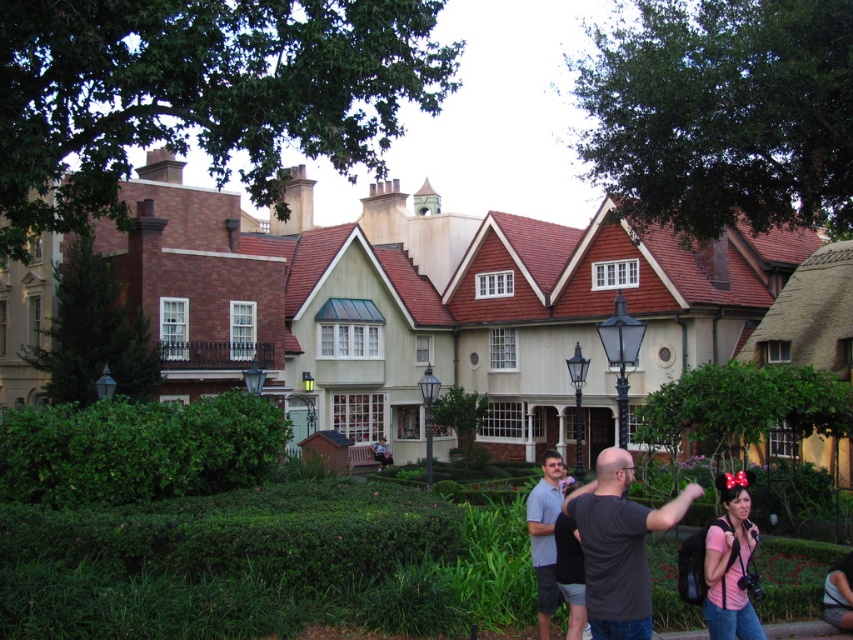
Question: Which point is farther to the camera?

Choices:
 (A) (57, 410)
 (B) (635, 520)
 (C) (741, 625)

Answer: (A)

Question: Which object is the farthest from the dark gray t-shirt at center?

Choices:
 (A) matte beige house at center
 (B) green leafy hedge at center

Answer: (A)

Question: Is dark gray t-shirt at center closer to the viewer compared to pink fabric at lower right?

Choices:
 (A) yes
 (B) no

Answer: (A)

Question: Based on their relative distances, which object is nearer to the matte beige house at center?

Choices:
 (A) dark gray t-shirt at center
 (B) green leafy hedge at center

Answer: (B)

Question: Can you confirm if green leafy hedge at center is wider than dark gray t-shirt at center?

Choices:
 (A) no
 (B) yes

Answer: (B)

Question: Does green leafy hedge at center appear over gray cotton shirt at center?

Choices:
 (A) no
 (B) yes

Answer: (B)